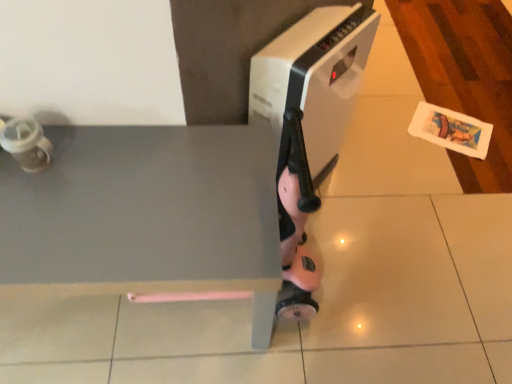
Locate an element on the screen. Image resolution: width=512 pixels, height=384 pixels. vacant area on top of white plastic heater at center (from a real-world perspective) is located at coordinates (331, 33).